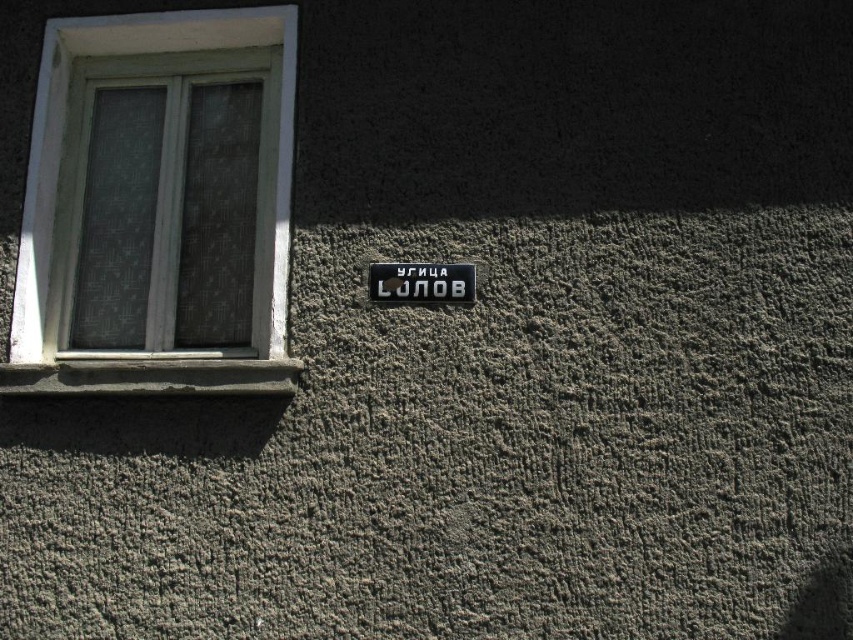
You are a painter standing at the base of the building. You need to paint the black plastic sign at center but want to avoid getting paint on the white plastic window at upper left. Which object should you be careful not to paint over while working on the sign?

The white plastic window at upper left is in front of the black plastic sign at center, so you must be careful not to paint over the white plastic window at upper left while working on the sign.

You are standing in front of a building and notice the white plastic window at upper left and the black plastic sign at center. Which object takes up more space in the image?

The white plastic window at upper left is bigger than the black plastic sign at center, so it takes up more space in the image.